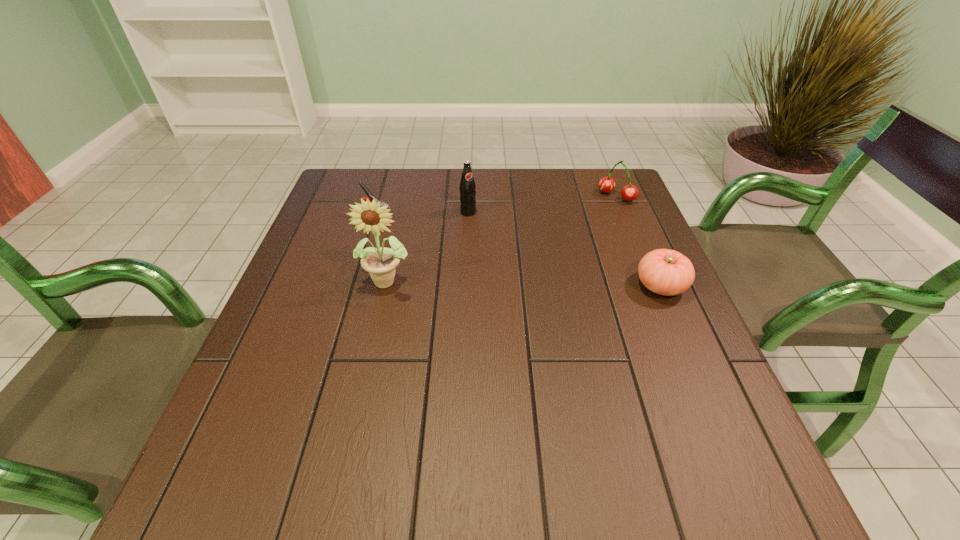
The height and width of the screenshot is (540, 960). What are the coordinates of `free space at the far right corner of the desktop` in the screenshot? It's located at (602, 208).

Where is `blank space at the near right corner`? blank space at the near right corner is located at coordinates click(718, 419).

Identify the location of free space between the tallest object and the tomato. This screenshot has height=540, width=960. (525, 283).

The image size is (960, 540). In order to click on vacant space that is in between the sunflower and the farthest object in this screenshot , I will do `click(503, 238)`.

Locate an element on the screen. vacant space that's between the sunflower and the second tallest object is located at coordinates (428, 246).

Where is `vacant area that lies between the cherry and the tomato`? Image resolution: width=960 pixels, height=540 pixels. vacant area that lies between the cherry and the tomato is located at coordinates (638, 241).

Find the location of a particular element. This screenshot has width=960, height=540. free space between the stapler and the tomato is located at coordinates (518, 252).

What are the coordinates of `free point between the stapler and the cherry` in the screenshot? It's located at (496, 207).

You are a GUI agent. You are given a task and a screenshot of the screen. Output one action in this format:
    pyautogui.click(x=<x>, y=<y>)
    Task: Click on the free space between the stapler and the tomato
    Image resolution: width=960 pixels, height=540 pixels.
    Given the screenshot: What is the action you would take?
    pyautogui.click(x=518, y=252)

This screenshot has width=960, height=540. Identify the location of vacant space in between the farthest object and the stapler. (496, 207).